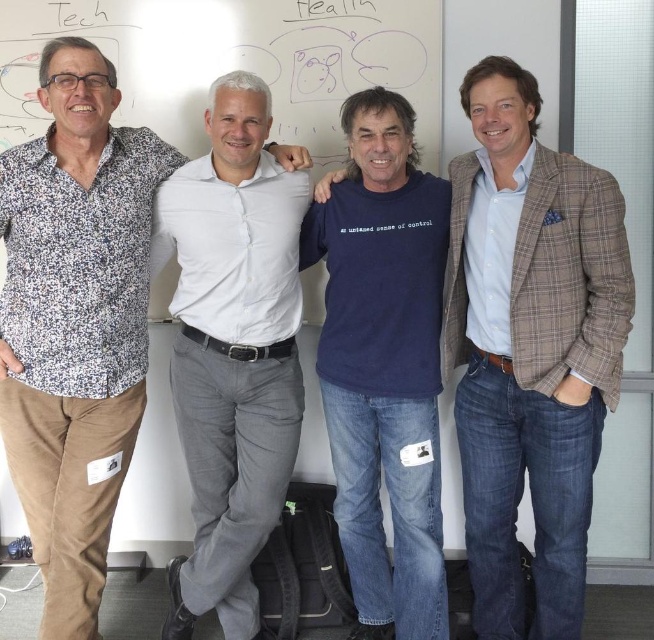
Question: Considering the real-world distances, which object is farthest from the blue cotton t-shirt at center?

Choices:
 (A) white smooth shirt at center
 (B) dark blue cotton t-shirt at center
 (C) floral print shirt at left

Answer: (C)

Question: Is blue cotton t-shirt at center thinner than dark blue cotton t-shirt at center?

Choices:
 (A) no
 (B) yes

Answer: (A)

Question: Where is blue cotton t-shirt at center located in relation to dark blue cotton t-shirt at center in the image?

Choices:
 (A) above
 (B) below

Answer: (A)

Question: Is blue cotton t-shirt at center closer to camera compared to white smooth shirt at center?

Choices:
 (A) yes
 (B) no

Answer: (A)

Question: Which is nearer to the floral print shirt at left?

Choices:
 (A) white smooth shirt at center
 (B) dark blue cotton t-shirt at center
 (C) blue cotton t-shirt at center

Answer: (A)

Question: Which object is farther from the camera taking this photo?

Choices:
 (A) white smooth shirt at center
 (B) blue cotton t-shirt at center
 (C) floral print shirt at left

Answer: (A)